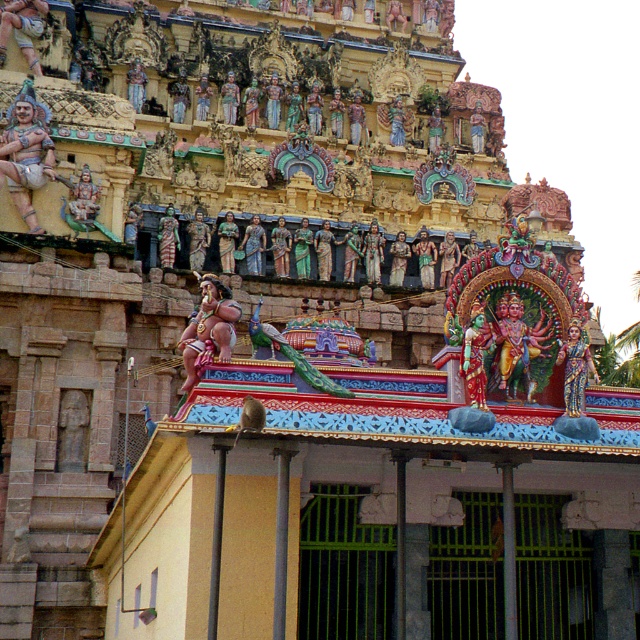
Question: Which object is farther from the camera taking this photo?

Choices:
 (A) polished bronze statue at center
 (B) golden polished statue at center
 (C) glossy painted statue at center

Answer: (A)

Question: Is glossy painted statue at center below polished bronze statue at center?

Choices:
 (A) yes
 (B) no

Answer: (A)

Question: Which object appears farthest from the camera in this image?

Choices:
 (A) golden painted statue at center
 (B) golden polished statue at center
 (C) polished bronze statue at center

Answer: (C)

Question: Which is farther from the golden painted statue at center?

Choices:
 (A) golden polished statue at center
 (B) glossy painted statue at center

Answer: (A)

Question: Is the position of golden polished statue at center less distant than that of polished bronze statue at center?

Choices:
 (A) no
 (B) yes

Answer: (B)

Question: Does golden polished statue at center have a smaller size compared to golden painted statue at center?

Choices:
 (A) yes
 (B) no

Answer: (B)